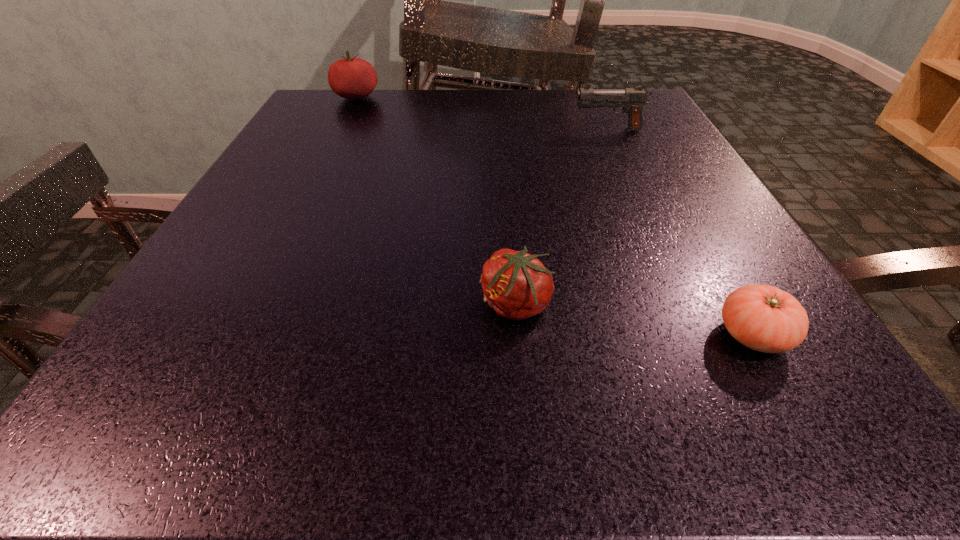
This screenshot has height=540, width=960. Find the location of `vacant area between the second farthest object and the tallest tomato`. vacant area between the second farthest object and the tallest tomato is located at coordinates tap(482, 113).

Where is `vacant region between the rightmost tomato and the second tomato from right to left`? The height and width of the screenshot is (540, 960). vacant region between the rightmost tomato and the second tomato from right to left is located at coordinates (634, 320).

Where is `free space between the second farthest object and the rightmost tomato`? The width and height of the screenshot is (960, 540). free space between the second farthest object and the rightmost tomato is located at coordinates (680, 232).

At what (x,y) coordinates should I click in order to perform the action: click on free point between the gun and the rightmost tomato. Please return your answer as a coordinate pair (x, y). Looking at the image, I should click on (680, 232).

Where is `free space between the second object from left to right and the tallest tomato`? The height and width of the screenshot is (540, 960). free space between the second object from left to right and the tallest tomato is located at coordinates (436, 201).

Locate an element on the screen. empty location between the second farthest object and the second tomato from right to left is located at coordinates (562, 217).

This screenshot has height=540, width=960. In order to click on object that ranks as the third closest to the second tomato from left to right in this screenshot , I will do `click(352, 78)`.

Point out which object is positioned as the nearest to the rightmost tomato. Please provide its 2D coordinates. Your answer should be formatted as a tuple, i.e. [(x, y)], where the tuple contains the x and y coordinates of a point satisfying the conditions above.

[(515, 284)]

At what (x,y) coordinates should I click in order to perform the action: click on the second closest tomato relative to the second tomato from left to right. Please return your answer as a coordinate pair (x, y). Looking at the image, I should click on (352, 78).

Identify the location of tomato that stands as the second closest to the third nearest object. (515, 284).